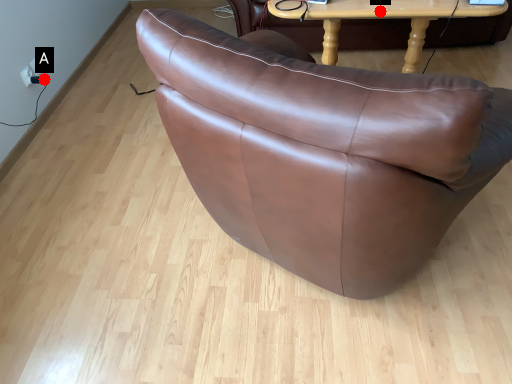
Question: Two points are circled on the image, labeled by A and B beside each circle. Which of the following is the farthest from the observer?

Choices:
 (A) A is further
 (B) B is further

Answer: (A)